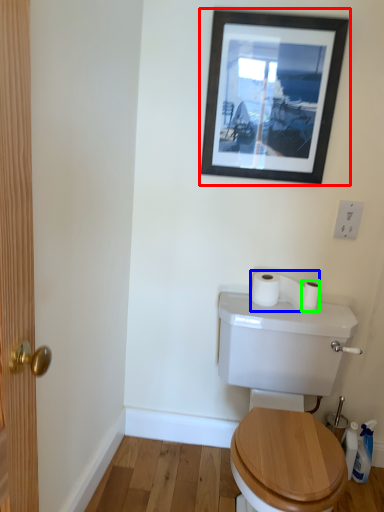
Question: Which object is positioned farthest from picture frame (highlighted by a red box)? Select from toilet paper (highlighted by a blue box) and toilet paper (highlighted by a green box).

Choices:
 (A) toilet paper
 (B) toilet paper

Answer: (B)